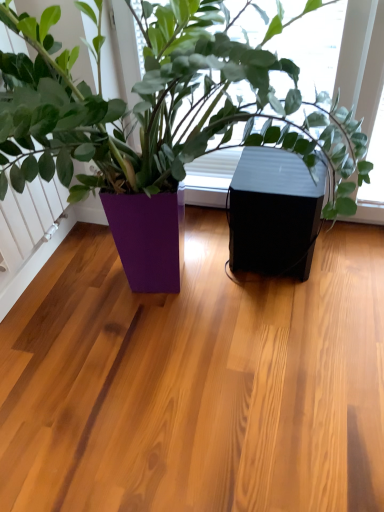
This screenshot has height=512, width=384. I want to click on vacant area situated below purple glossy planter at center (from a real-world perspective), so click(x=205, y=321).